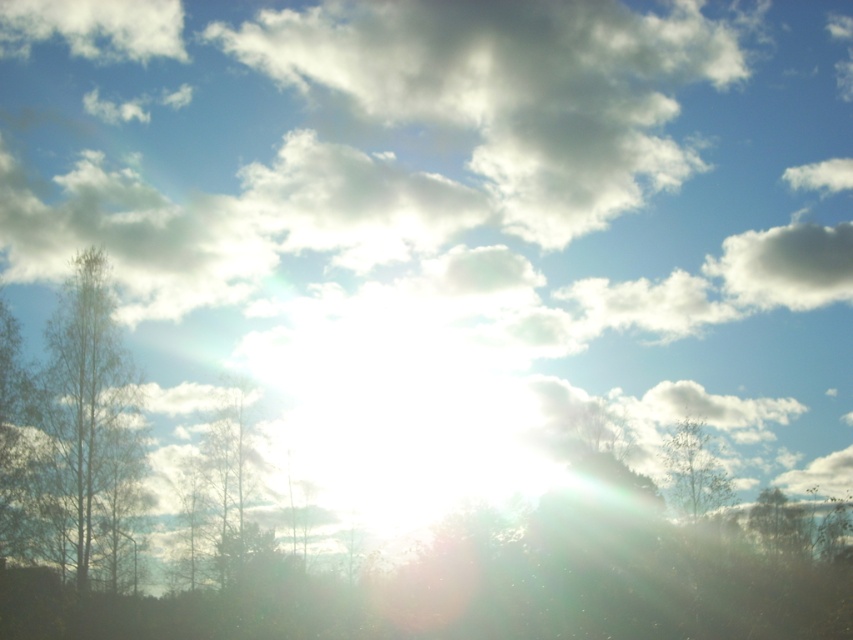
Does green leafy tree at left have a greater width compared to white fluffy cloud at upper left?

Incorrect, green leafy tree at left's width does not surpass white fluffy cloud at upper left's.

Which of these two, green leafy tree at left or white fluffy cloud at upper left, stands shorter?

white fluffy cloud at upper left is shorter.

Does point (49, 337) come in front of point (144, 29)?

Yes, point (49, 337) is closer to viewer.

Find the location of a particular element. This screenshot has width=853, height=640. green leafy tree at left is located at coordinates tap(86, 435).

Does white fluffy cloud at upper center lie in front of green leafy tree at right?

No.

Locate an element on the screen. white fluffy cloud at upper center is located at coordinates (512, 90).

Can you confirm if white fluffy cloud at upper center is wider than green matte tree at left?

Yes.

Is point (390, 12) positioned in front of point (251, 429)?

No, it is not.

Locate an element on the screen. Image resolution: width=853 pixels, height=640 pixels. white fluffy cloud at upper center is located at coordinates (512, 90).